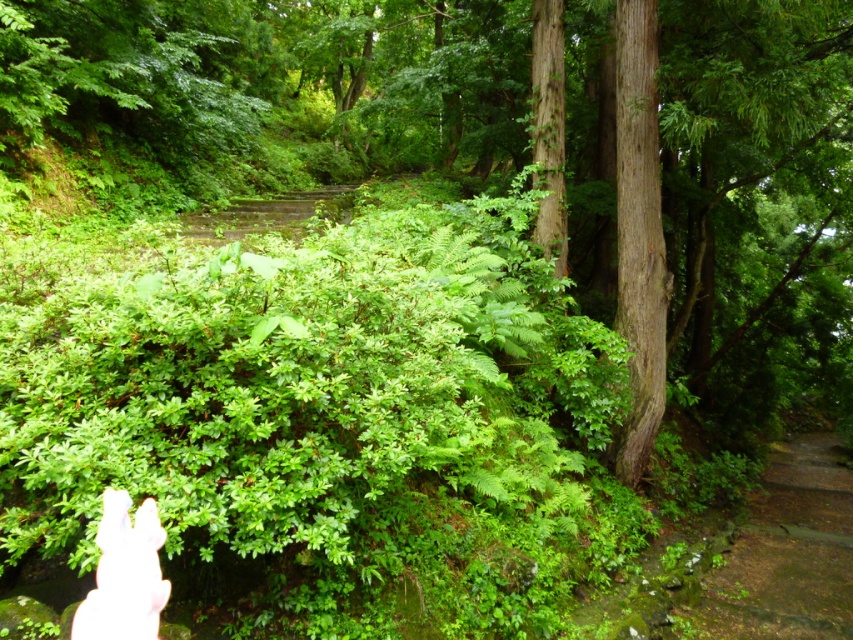
You are a hiker who has just entered the forest and notices the brown dirt stairs at lower right and the white flesh at lower left. Which object is positioned lower in the scene?

The brown dirt stairs at lower right is located below white flesh at lower left, so the brown dirt stairs at lower right is positioned lower in the scene.

You are a hiker trying to navigate through the forest. You see the brown dirt stairs at lower right and the smooth brown tree trunk at right. Which one is shorter in height?

The brown dirt stairs at lower right is shorter in height compared to the smooth brown tree trunk at right.

You are a hiker who wants to follow the path upwards. You see the brown dirt stairs at lower right and the smooth brown tree trunk at right. Which one is positioned to the right side of the other?

The brown dirt stairs at lower right are to the right of the smooth brown tree trunk at right.